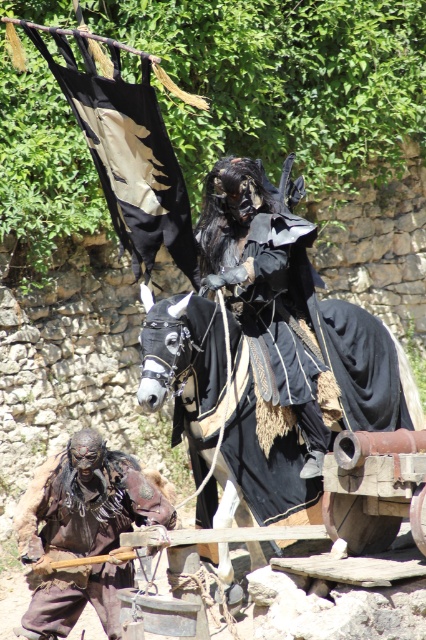
In the scene shown: Can you confirm if black leather horse at center is bigger than rusty metal armor at lower left?

No.

Which is behind, point (204, 506) or point (92, 576)?

The point (204, 506) is more distant.

I want to click on black leather horse at center, so click(218, 413).

Can you confirm if black leather horse at center is wider than black matte costume at center?

No.

Describe the element at coordinates (218, 413) in the screenshot. I see `black leather horse at center` at that location.

The image size is (426, 640). Identify the location of black leather horse at center. (218, 413).

Is point (108, 600) positioned in front of point (218, 198)?

Yes, point (108, 600) is closer to viewer.

Is point (69, 490) less distant than point (307, 365)?

Yes, it is in front of point (307, 365).

The height and width of the screenshot is (640, 426). I want to click on rusty metal armor at lower left, so click(86, 500).